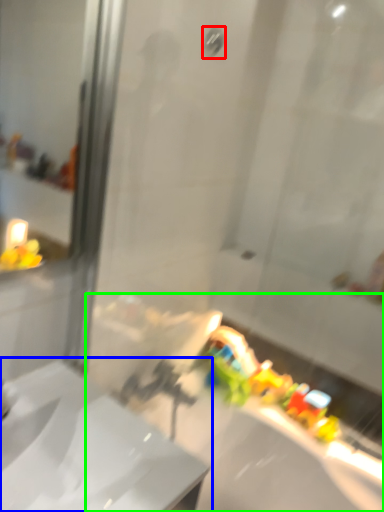
Question: Estimate the real-world distances between objects in this image. Which object is closer to shower (highlighted by a red box), sink (highlighted by a blue box) or bath (highlighted by a green box)?

Choices:
 (A) sink
 (B) bath

Answer: (A)